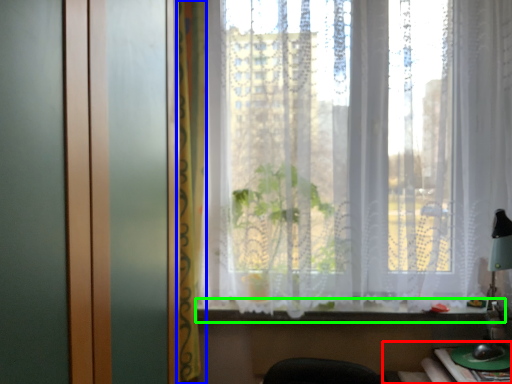
Question: Considering the real-world distances, which object is closest to table (highlighted by a red box)? curtain (highlighted by a blue box) or window sill (highlighted by a green box).

Choices:
 (A) curtain
 (B) window sill

Answer: (B)